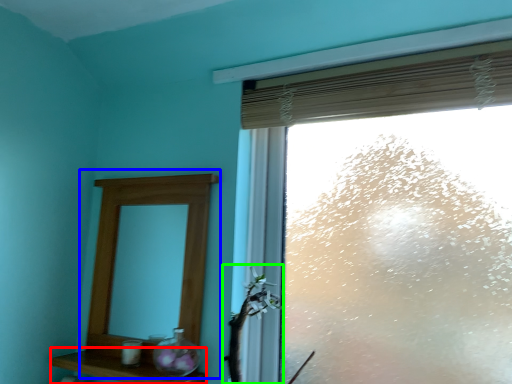
Question: Based on their relative distances, which object is farther from shelf (highlighted by a red box)? Choose from medicine cabinet (highlighted by a blue box) and plant (highlighted by a green box).

Choices:
 (A) medicine cabinet
 (B) plant

Answer: (B)